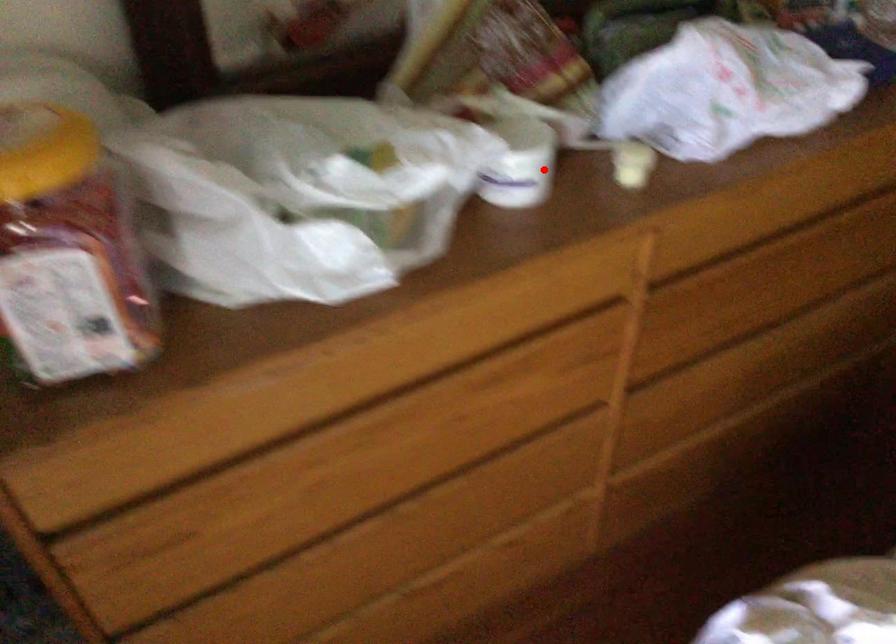
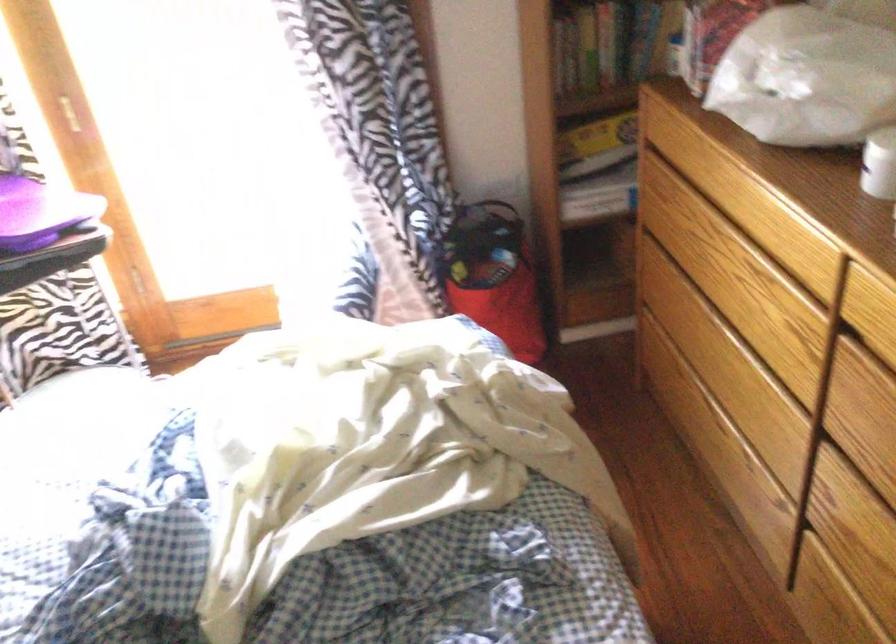
Find the pixel in the second image that matches the highlighted location in the first image.

(879, 164)